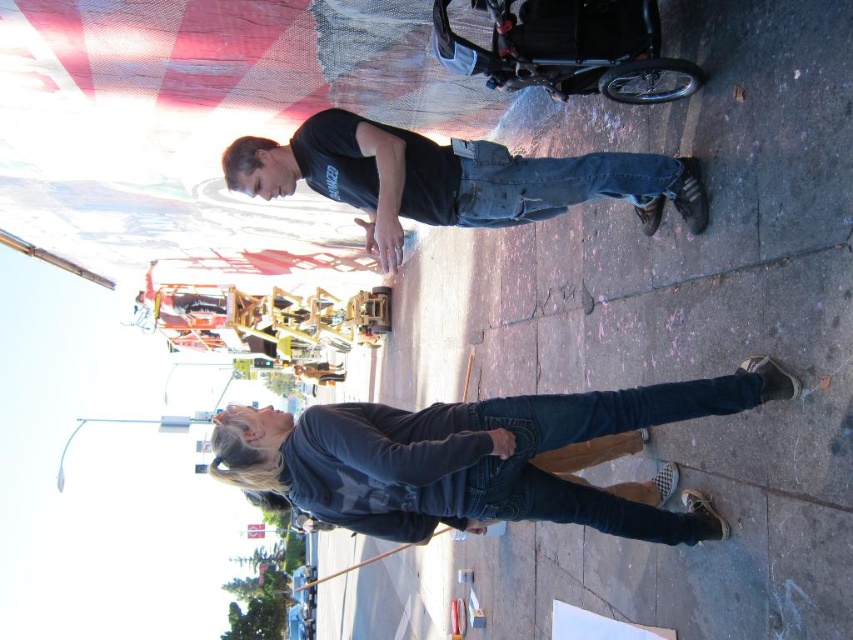
Question: Which object appears closest to the camera in this image?

Choices:
 (A) black matte shirt at center
 (B) denim jeans at lower center

Answer: (B)

Question: Can you confirm if denim jeans at lower center is positioned below black matte shirt at center?

Choices:
 (A) yes
 (B) no

Answer: (A)

Question: Which point is farther from the camera taking this photo?

Choices:
 (A) pyautogui.click(x=320, y=152)
 (B) pyautogui.click(x=328, y=410)

Answer: (A)

Question: Which object appears farthest from the camera in this image?

Choices:
 (A) black matte shirt at center
 (B) denim jeans at lower center

Answer: (A)

Question: Is denim jeans at lower center thinner than black matte shirt at center?

Choices:
 (A) no
 (B) yes

Answer: (A)

Question: Is black matte shirt at center to the left of denim jeans at center from the viewer's perspective?

Choices:
 (A) no
 (B) yes

Answer: (B)